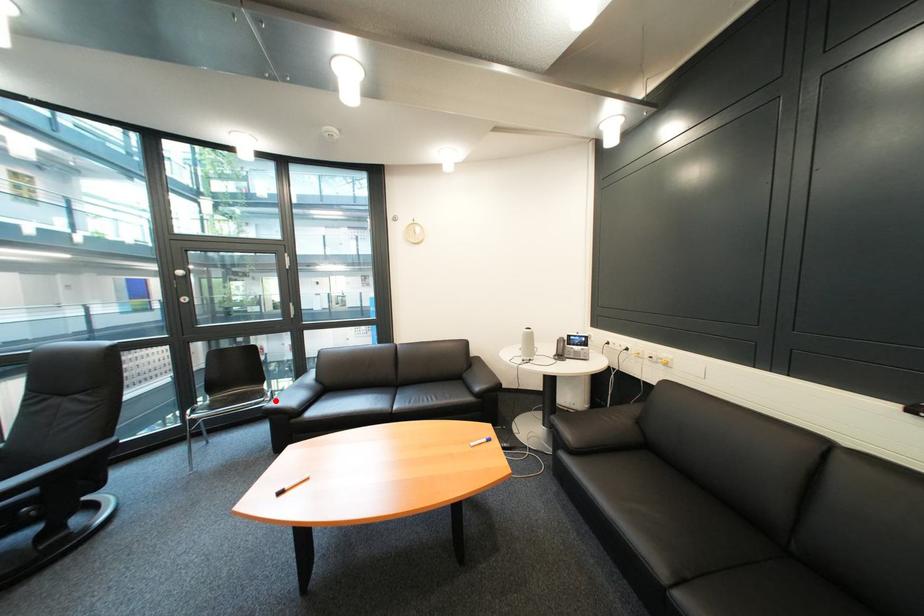
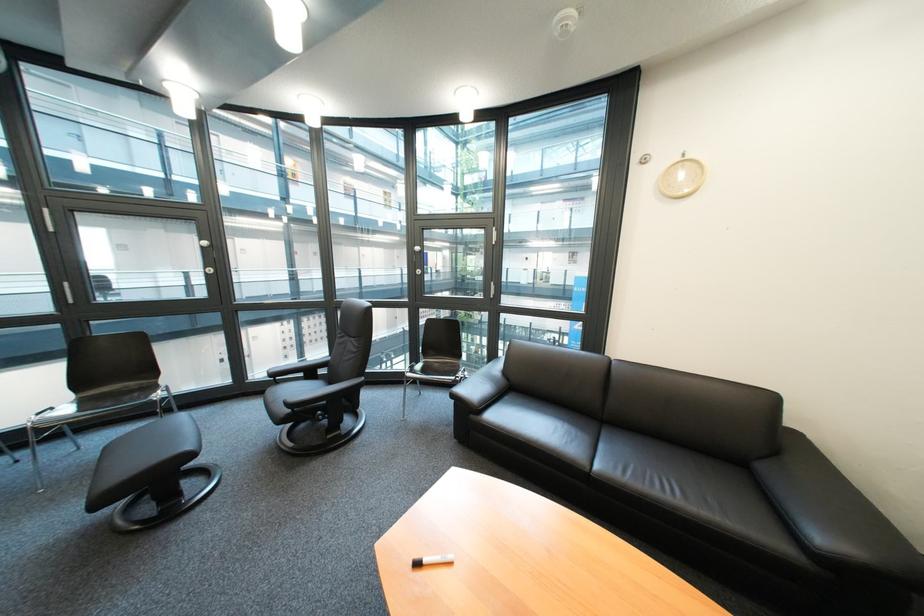
Locate, in the second image, the point that corresponds to the highlighted location in the first image.

(467, 379)